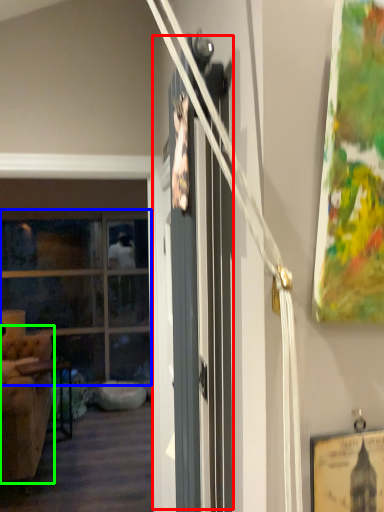
Question: Which is nearer to the barn door (highlighted by a red box)? window (highlighted by a blue box) or armchair (highlighted by a green box).

Choices:
 (A) window
 (B) armchair

Answer: (B)